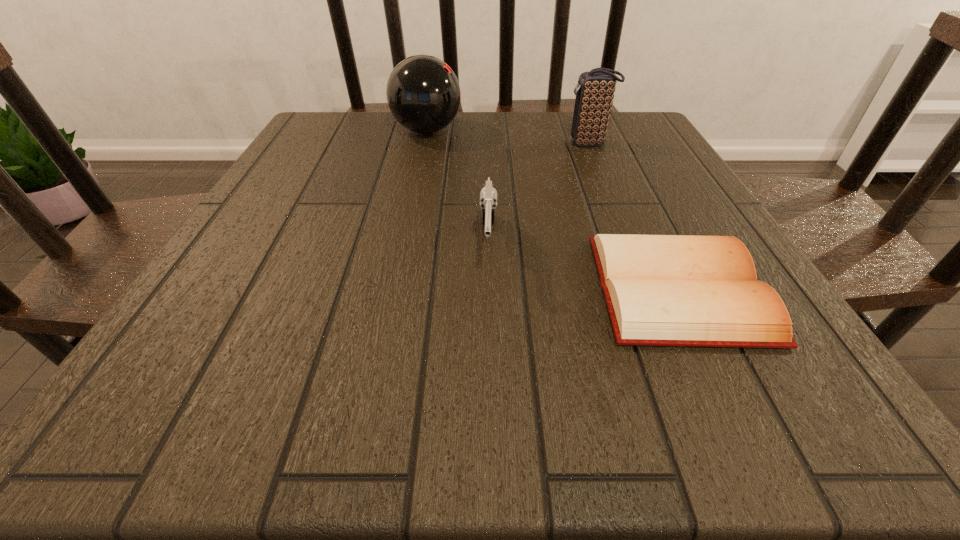
The height and width of the screenshot is (540, 960). What are the coordinates of `vacant space that is in between the clutch bag and the gun` in the screenshot? It's located at (539, 195).

Locate an element on the screen. blank region between the clutch bag and the third tallest object is located at coordinates [539, 195].

Where is `free space between the shortest object and the clutch bag`? The image size is (960, 540). free space between the shortest object and the clutch bag is located at coordinates (634, 215).

Find the location of a particular element. empty space between the gun and the bowling ball is located at coordinates (458, 188).

At what (x,y) coordinates should I click in order to perform the action: click on empty space that is in between the clutch bag and the Bible. Please return your answer as a coordinate pair (x, y). This screenshot has width=960, height=540. Looking at the image, I should click on (634, 215).

This screenshot has width=960, height=540. In order to click on free space between the shortest object and the clutch bag in this screenshot , I will do `click(634, 215)`.

This screenshot has width=960, height=540. I want to click on empty location between the leftmost object and the gun, so click(x=458, y=188).

The image size is (960, 540). Find the location of `free point between the third tallest object and the bowling ball`. free point between the third tallest object and the bowling ball is located at coordinates (458, 188).

The image size is (960, 540). What are the coordinates of `free space between the shortest object and the leftmost object` in the screenshot? It's located at (553, 210).

You are a GUI agent. You are given a task and a screenshot of the screen. Output one action in this format:
    pyautogui.click(x=<x>, y=<y>)
    Task: Click on the object identified as the closest to the clutch bag
    
    Given the screenshot: What is the action you would take?
    pyautogui.click(x=423, y=93)